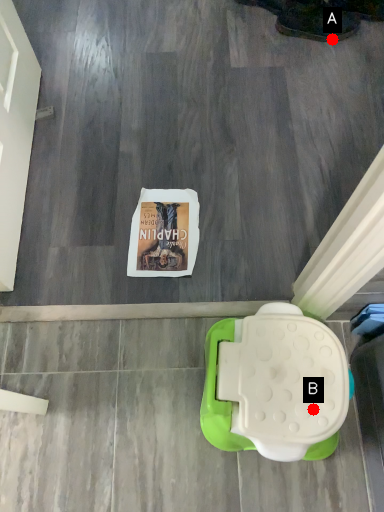
Question: Two points are circled on the image, labeled by A and B beside each circle. Which point is farther to the camera?

Choices:
 (A) A is further
 (B) B is further

Answer: (A)